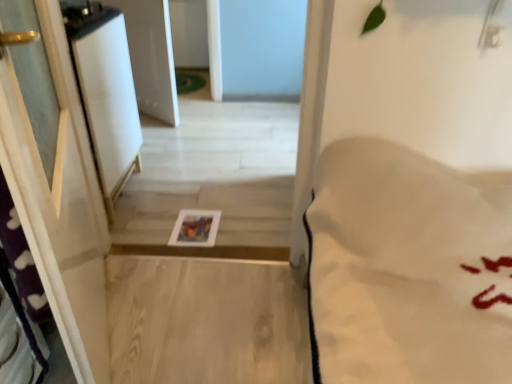
Question: From a real-world perspective, is white glossy screen door at left physically located above or below white soft bedsheet at right?

Choices:
 (A) below
 (B) above

Answer: (B)

Question: Does point (109, 119) appear closer or farther from the camera than point (373, 307)?

Choices:
 (A) farther
 (B) closer

Answer: (A)

Question: From the image's perspective, is white glossy screen door at left located above or below white soft bedsheet at right?

Choices:
 (A) below
 (B) above

Answer: (B)

Question: In the image, is white soft bedsheet at right on the left side or the right side of white glossy screen door at left?

Choices:
 (A) right
 (B) left

Answer: (A)

Question: Considering the positions of white soft bedsheet at right and white glossy screen door at left in the image, is white soft bedsheet at right bigger or smaller than white glossy screen door at left?

Choices:
 (A) big
 (B) small

Answer: (A)

Question: From a real-world perspective, is white soft bedsheet at right physically located above or below white glossy screen door at left?

Choices:
 (A) below
 (B) above

Answer: (A)

Question: Relative to white glossy screen door at left, is white soft bedsheet at right in front or behind?

Choices:
 (A) behind
 (B) front

Answer: (B)